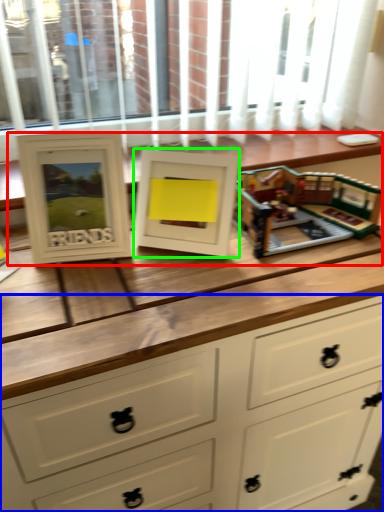
Question: Which is nearer to the buffet (highlighted by a red box)? chest of drawers (highlighted by a blue box) or picture frame (highlighted by a green box).

Choices:
 (A) chest of drawers
 (B) picture frame

Answer: (B)